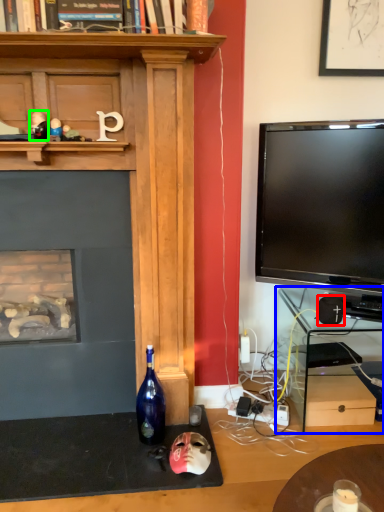
Question: Which object is positioned farthest from speaker (highlighted by a red box)? Select from computer desk (highlighted by a blue box) and toy (highlighted by a green box).

Choices:
 (A) computer desk
 (B) toy

Answer: (B)